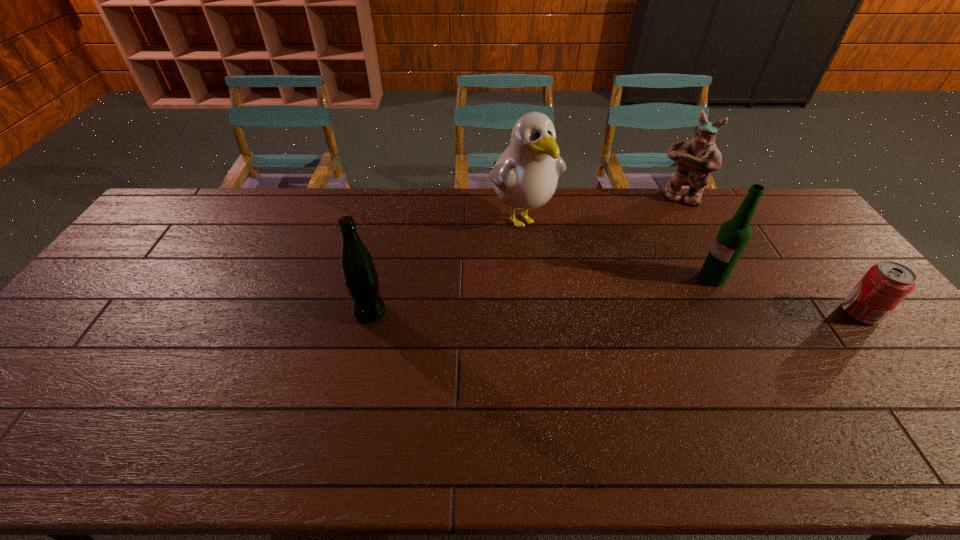
The image size is (960, 540). Identify the location of free space on the desktop that is between the nearer beer bottle and the shortest object and is positioned on the front-facing side of the figurine. (650, 313).

Identify the location of vacant space on the desktop that is between the left beer bottle and the rightmost object and is positioned on the beak of the tallest object. Image resolution: width=960 pixels, height=540 pixels. (598, 313).

The height and width of the screenshot is (540, 960). In order to click on free space on the desktop that is between the nearer beer bottle and the shortest object and is positioned on the label of the third farthest object in this screenshot , I will do `click(651, 313)`.